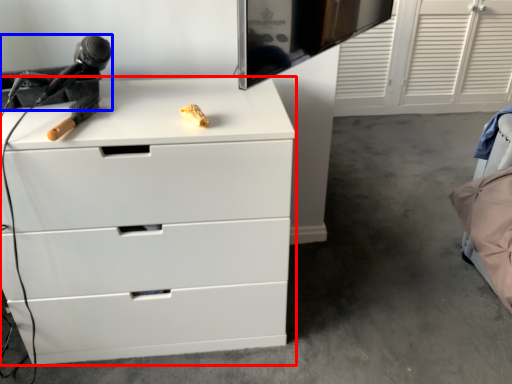
Question: Which object appears farthest to the camera in this image, chest of drawers (highlighted by a red box) or equipment (highlighted by a blue box)?

Choices:
 (A) chest of drawers
 (B) equipment

Answer: (B)